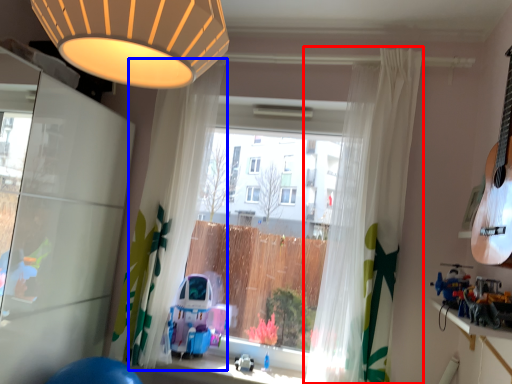
Question: Which of the following is the farthest to the observer, curtain (highlighted by a red box) or curtain (highlighted by a blue box)?

Choices:
 (A) curtain
 (B) curtain

Answer: (B)